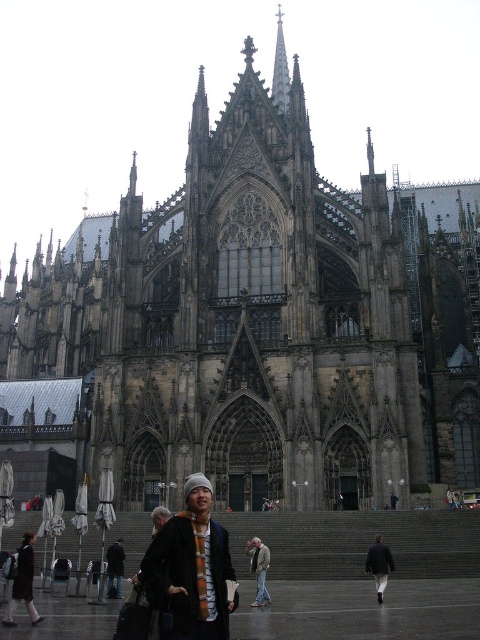
Can you confirm if orange scarf at lower left is positioned below light gray jacket at center?

No, orange scarf at lower left is not below light gray jacket at center.

Does orange scarf at lower left have a greater height compared to light gray jacket at center?

Indeed, orange scarf at lower left has a greater height compared to light gray jacket at center.

Is point (22, 579) less distant than point (249, 550)?

Yes, it is.

Image resolution: width=480 pixels, height=640 pixels. I want to click on orange scarf at lower left, so click(x=23, y=582).

Does point (108, 566) come farther from viewer compared to point (396, 502)?

No.

Is orange scarf at center above dark gray knit hat at center?

No.

What do you see at coordinates (115, 566) in the screenshot?
I see `orange scarf at center` at bounding box center [115, 566].

Where is `orange scarf at center`? Image resolution: width=480 pixels, height=640 pixels. orange scarf at center is located at coordinates (115, 566).

Which is in front, point (257, 561) or point (118, 568)?

Point (257, 561) is more forward.

Which is below, light gray jacket at center or orange scarf at center?

light gray jacket at center is lower down.

Between point (255, 605) and point (117, 544), which one is positioned in front?

Point (255, 605) is more forward.

This screenshot has width=480, height=640. What are the coordinates of `light gray jacket at center` in the screenshot? It's located at (259, 570).